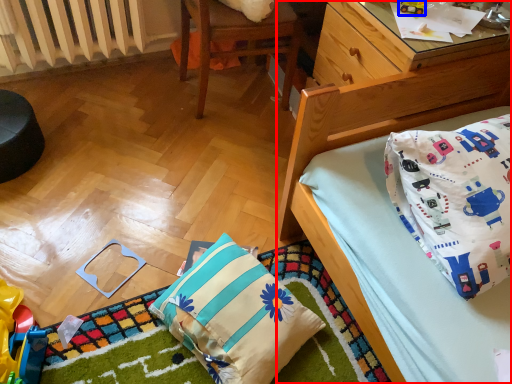
Question: Which point is further to the camera, bed (highlighted by a red box) or toy (highlighted by a blue box)?

Choices:
 (A) bed
 (B) toy

Answer: (B)